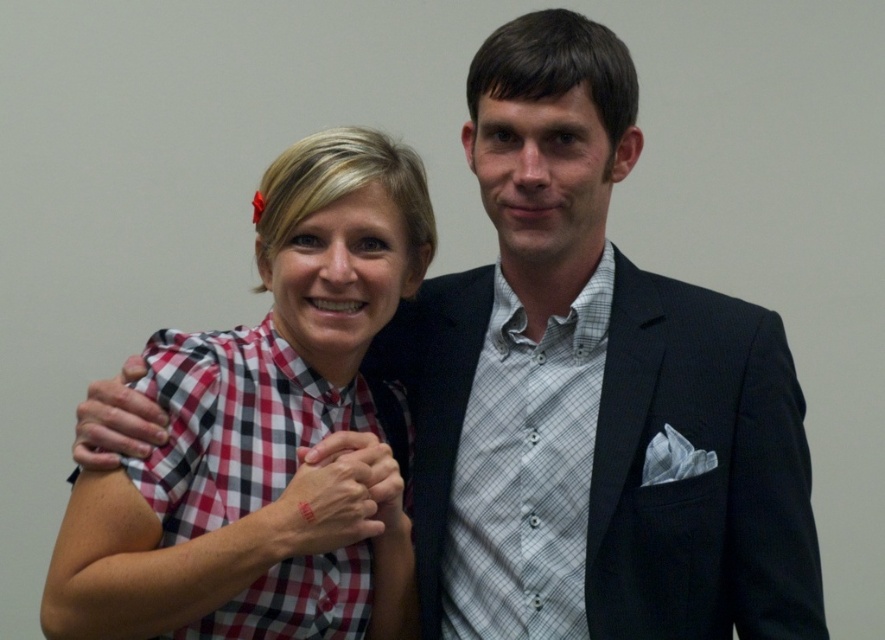
Does gray checkered shirt at center appear over matte red checkered shirt at center?

Indeed, gray checkered shirt at center is positioned over matte red checkered shirt at center.

Is gray checkered shirt at center taller than matte red checkered shirt at center?

Indeed, gray checkered shirt at center has a greater height compared to matte red checkered shirt at center.

Is point (558, 620) farther from viewer compared to point (390, 518)?

No.

Find the location of a particular element. gray checkered shirt at center is located at coordinates (526, 470).

Can you confirm if checkered fabric shirt at center is positioned to the left of matte red plaid shirt at upper left?

In fact, checkered fabric shirt at center is to the right of matte red plaid shirt at upper left.

Based on the photo, is checkered fabric shirt at center positioned at the back of matte red plaid shirt at upper left?

No, checkered fabric shirt at center is closer to the viewer.

What do you see at coordinates (267, 435) in the screenshot? I see `checkered fabric shirt at center` at bounding box center [267, 435].

Image resolution: width=885 pixels, height=640 pixels. I want to click on checkered fabric shirt at center, so click(267, 435).

Does checkered fabric shirt at center have a lesser height compared to matte red checkered shirt at center?

Incorrect, checkered fabric shirt at center's height does not fall short of matte red checkered shirt at center's.

Is point (319, 394) positioned before point (364, 532)?

No, (319, 394) is behind (364, 532).

At what (x,y) coordinates should I click in order to perform the action: click on checkered fabric shirt at center. Please return your answer as a coordinate pair (x, y). The image size is (885, 640). Looking at the image, I should click on (267, 435).